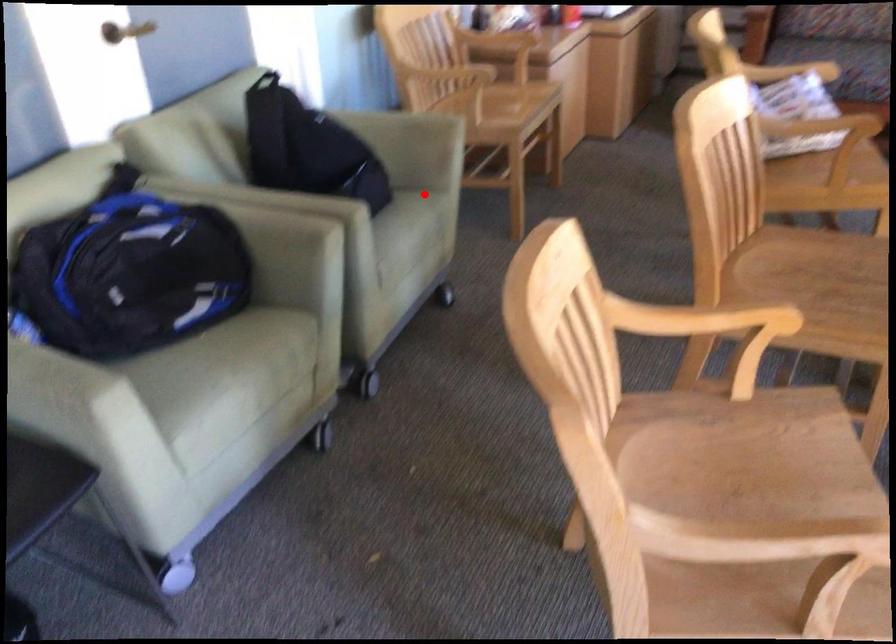
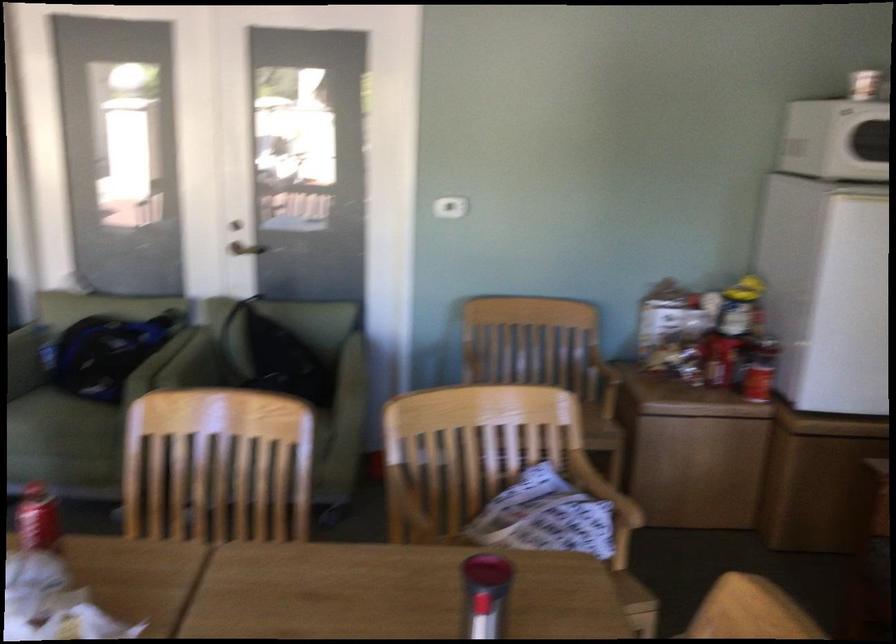
Question: I am providing you with two images of the same scene from different viewpoints. A red point is shown in image1. For the corresponding object point in image2, is it positioned nearer or farther from the camera?

Choices:
 (A) Nearer
 (B) Farther

Answer: (B)